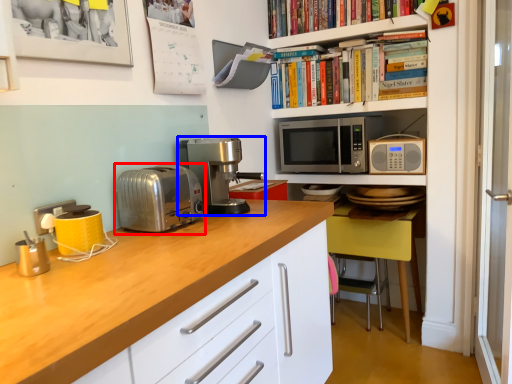
Question: Which object appears farthest to the camera in this image, toaster (highlighted by a red box) or coffee machine (highlighted by a blue box)?

Choices:
 (A) toaster
 (B) coffee machine

Answer: (B)